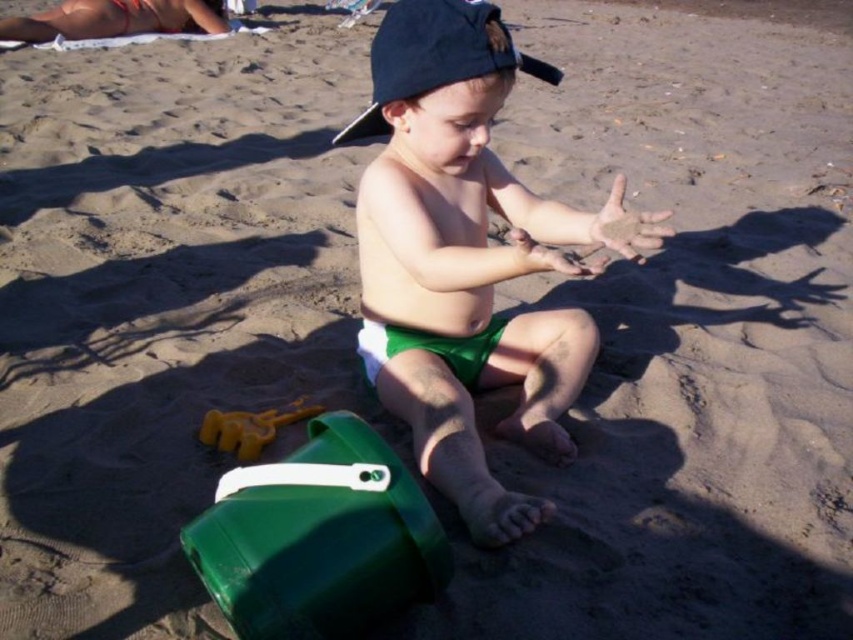
You are a parent trying to retrieve the green plastic bucket at lower left from your child, the green fabric toddler at center. The toddler is holding the bucket. Can you reach the bucket without moving closer than 18 inches?

The distance between the green fabric toddler at center and the green plastic bucket at lower left is 18.53 inches. Since 18.53 inches is slightly more than 18 inches, you cannot reach the bucket without moving closer.

You are a parent watching your child on the beach. You see the green fabric toddler at center and the green plastic bucket at lower left. Which object is positioned higher from the ground?

The green fabric toddler at center is above the green plastic bucket at lower left, so the toddler is positioned higher from the ground.